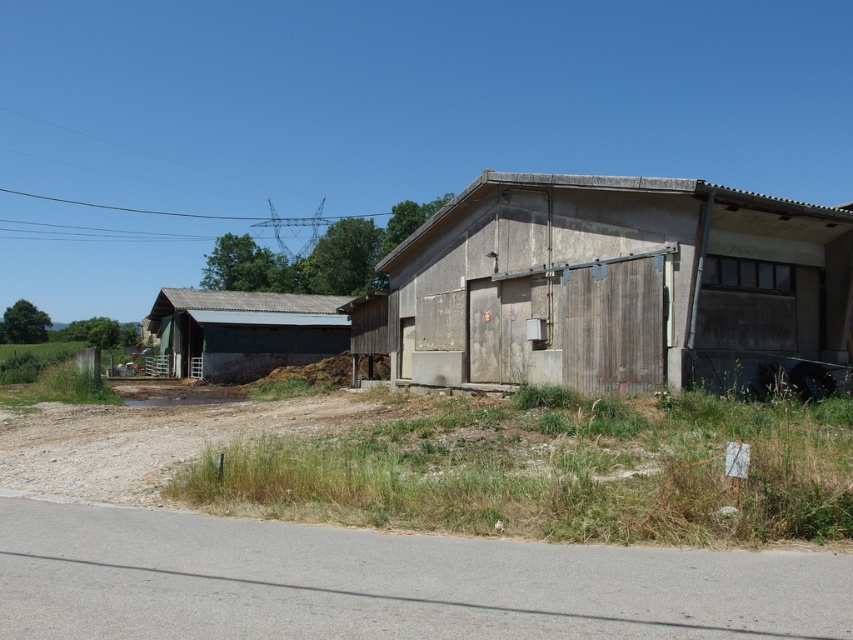
You are standing at the bottom of the image where the road is. Looking up towards the center of the image, which object would you see first between the rustic wood barn at center and the rusty metal hut at left?

The rustic wood barn at center would be seen first because it is located above the rusty metal hut at left, meaning it is closer to the viewer when looking upward from the road.

You are standing at the point labeled as point (618, 285) in the image. Which direction should you walk to reach the rustic wood barn at center?

The point labeled as point (618, 285) is already at the rustic wood barn at center, so you are already there.

You are planning to park a large truck that requires a minimum of 10 meters of space. You see the rustic wood barn at center and the rusty metal hut at left in the scene. Which structure has enough width to accommodate the truck?

The rusty metal hut at left has a greater width than the rustic wood barn at center, so it can accommodate the truck.